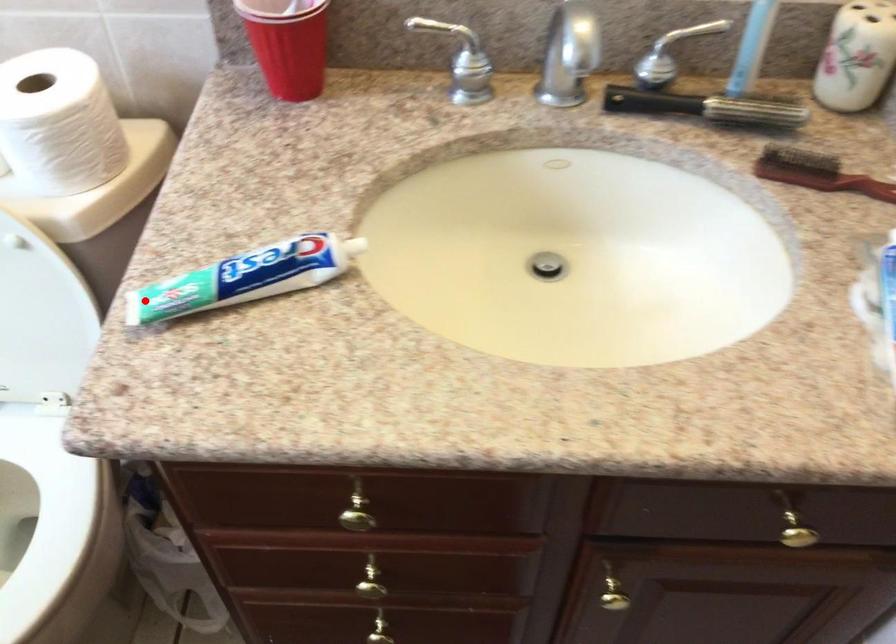
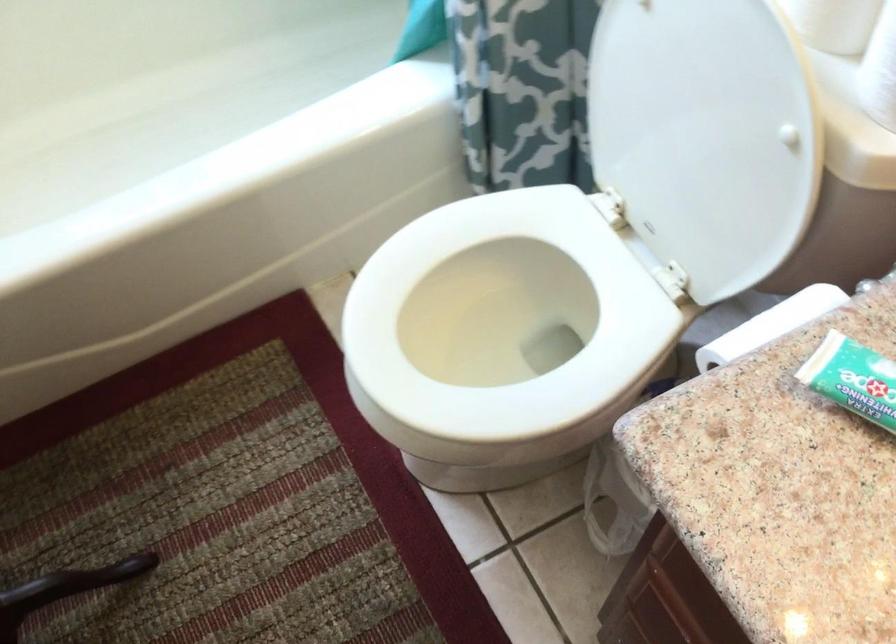
Where in the second image is the point corresponding to the highlighted location from the first image?

(853, 379)